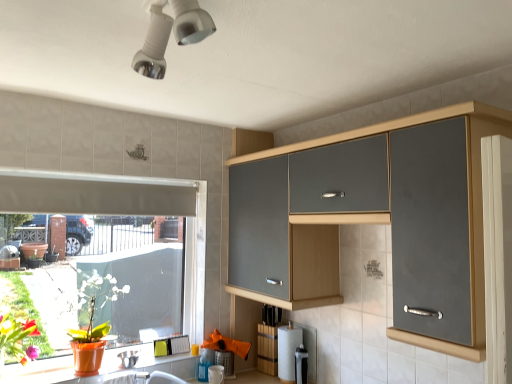
Question: In the image, is matte orange pot at lower left positioned in front of or behind white matte exhaust hood at left?

Choices:
 (A) behind
 (B) front

Answer: (B)

Question: Is matte orange pot at lower left inside the boundaries of white matte exhaust hood at left, or outside?

Choices:
 (A) inside
 (B) outside

Answer: (B)

Question: Estimate the real-world distances between objects in this image. Which object is closer to the white matte window at lower left?

Choices:
 (A) matte orange pot at lower left
 (B) white matte toilet paper at center
 (C) matte gray cabinet at upper right
 (D) white matte exhaust hood at left
 (E) satin black coffee maker at lower center, placed as the 2th appliance when sorted from left to right

Answer: (D)

Question: Based on their relative distances, which object is farther from the satin black coffee maker at lower center, placed as the 2th appliance when sorted from left to right?

Choices:
 (A) white matte window at lower left
 (B) matte gray cabinet at upper right
 (C) satin silver bowl at lower left, the first appliance viewed from the left
 (D) white glossy counter at lower left
 (E) white matte toilet paper at center

Answer: (B)